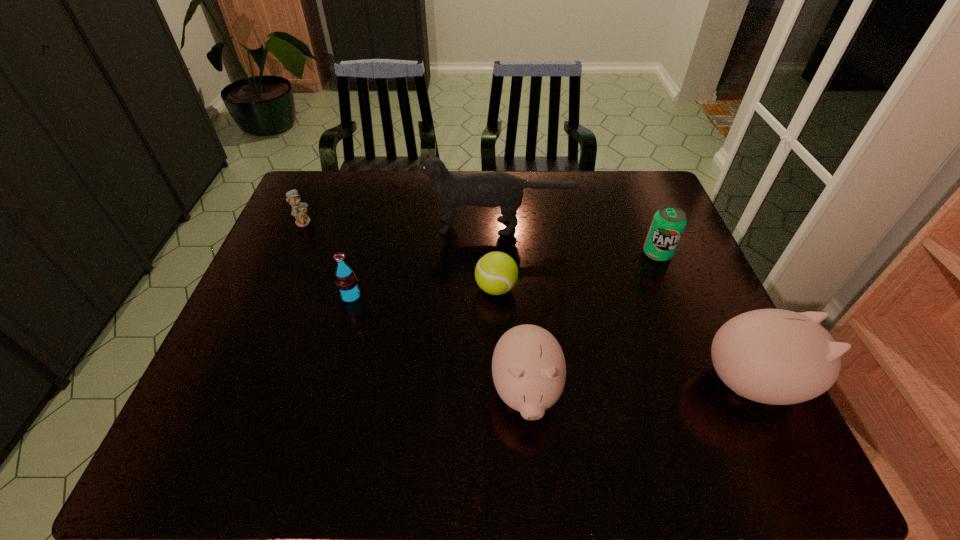
Considering the uniform spacing of piggy banks, where should an additional piggy bank be positioned on the left? Please locate a free spot. Please provide its 2D coordinates. Your answer should be formatted as a tuple, i.e. [(x, y)], where the tuple contains the x and y coordinates of a point satisfying the conditions above.

[(289, 401)]